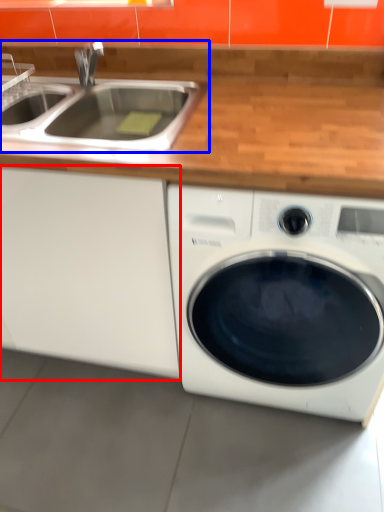
Question: Which of the following is the farthest to the observer, cabinetry (highlighted by a red box) or sink (highlighted by a blue box)?

Choices:
 (A) cabinetry
 (B) sink

Answer: (B)